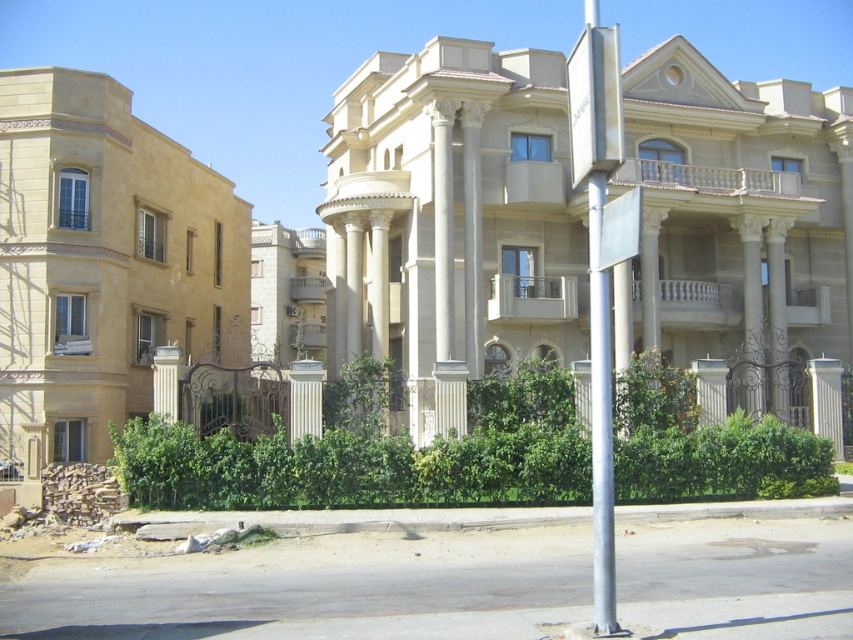
You are a delivery person approaching the two buildings. You need to place a package on the ground near the white marble pillar at left but want to avoid the green leafy bush at center. Can you do this easily?

The green leafy bush at center is further to the viewer than the white marble pillar at left, meaning the pillar is closer to you. Since the bush is behind the pillar, you can easily place the package near the white marble pillar at left without worrying about the bush being in the way.

You are a city planner reviewing a street layout. You need to determine if the metallic silver sign at upper center can be seen clearly from the sidewalk without obstruction. Considering the presence of the green leafy bush at center, is there any obstruction between the sign and the sidewalk?

The metallic silver sign at upper center is bigger than the green leafy bush at center, so it is likely that the sign can be seen clearly from the sidewalk as it may tower over or be positioned above the bush, minimizing obstruction.

Consider the image. You are standing at the point marked as point (x=585, y=145) in the image. You want to walk towards the building on the right. Is the building on the right closer to you than the building on the left?

The distance between point (x=585, y=145) and the viewer is 7.69 meters. However, the question asks about the distance between the buildings and the viewer, but the provided information only specifies the distance from the point to the viewer. Without knowing the exact positions of the buildings relative to the point, we cannot determine which building is closer. Please provide additional details about the buildings locations relative to the point.